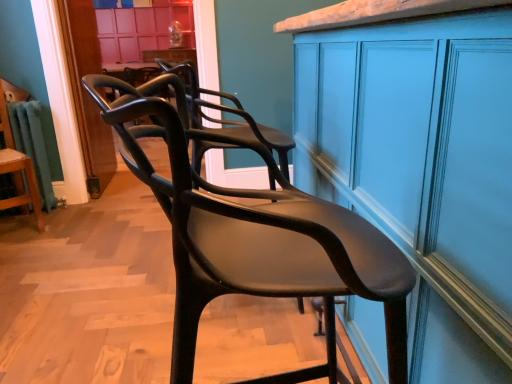
This screenshot has width=512, height=384. I want to click on matte blue cabinet at center, so click(x=419, y=160).

This screenshot has width=512, height=384. Find the location of `matte black chair at left, arranged as the 2th chair when viewed from the front`. matte black chair at left, arranged as the 2th chair when viewed from the front is located at coordinates (18, 170).

What are the coordinates of `matte blue cabinet at center` in the screenshot? It's located at (419, 160).

This screenshot has height=384, width=512. In order to click on chair below the matte blue cabinet at center (from the image's perspective) in this screenshot , I will do `click(255, 237)`.

Which is behind, point (268, 205) or point (449, 2)?

The point (449, 2) is farther.

From the picture: Is matte black chair at center, placed as the first chair when sorted from front to back, to the right of matte blue cabinet at center from the viewer's perspective?

Incorrect, matte black chair at center, placed as the first chair when sorted from front to back, is not on the right side of matte blue cabinet at center.

Is matte black chair at center, placed as the first chair when sorted from front to back, in contact with matte blue cabinet at center?

matte black chair at center, placed as the first chair when sorted from front to back, is not next to matte blue cabinet at center, and they're not touching.

Image resolution: width=512 pixels, height=384 pixels. Identify the location of the 1st chair below the matte blue cabinet at center (from a real-world perspective). (255, 237).

From a real-world perspective, is matte blue cabinet at center positioned above or below matte black chair at center, the 2th chair from the left?

Clearly, from a real-world perspective, matte blue cabinet at center is above matte black chair at center, the 2th chair from the left.

Looking at this image, does matte blue cabinet at center contain matte black chair at center, the second chair in the back-to-front sequence?

No, matte blue cabinet at center does not contain matte black chair at center, the second chair in the back-to-front sequence.

In terms of height, does matte blue cabinet at center look taller or shorter compared to matte black chair at center, the second chair in the back-to-front sequence?

Considering their sizes, matte blue cabinet at center has more height than matte black chair at center, the second chair in the back-to-front sequence.

Is matte black chair at left, which is counted as the first chair, starting from the left, placed right next to matte blue cabinet at center?

No, matte black chair at left, which is counted as the first chair, starting from the left, is not beside matte blue cabinet at center.

From the image's perspective, is matte black chair at left, the 1th chair from the back, below matte blue cabinet at center?

Actually, matte black chair at left, the 1th chair from the back, appears above matte blue cabinet at center in the image.

Does matte black chair at left, marked as the second chair in a right-to-left arrangement, have a larger size compared to matte blue cabinet at center?

No, matte black chair at left, marked as the second chair in a right-to-left arrangement, is not bigger than matte blue cabinet at center.

Can you confirm if matte black chair at center, positioned as the first chair in right-to-left order, is bigger than matte black chair at left, arranged as the 2th chair when viewed from the front?

Yes.

Looking at their sizes, would you say matte black chair at center, placed as the first chair when sorted from front to back, is wider or thinner than matte black chair at left, marked as the second chair in a right-to-left arrangement?

Clearly, matte black chair at center, placed as the first chair when sorted from front to back, has more width compared to matte black chair at left, marked as the second chair in a right-to-left arrangement.

In the scene shown: Is matte black chair at center, positioned as the first chair in right-to-left order, aimed at matte black chair at left, arranged as the 2th chair when viewed from the front?

No, matte black chair at center, positioned as the first chair in right-to-left order, is not facing towards matte black chair at left, arranged as the 2th chair when viewed from the front.

The image size is (512, 384). Identify the location of chair on the left of the matte black chair at center, the second chair in the back-to-front sequence. (18, 170).

From their relative heights in the image, would you say matte black chair at left, arranged as the 2th chair when viewed from the front, is taller or shorter than matte black chair at center, the second chair in the back-to-front sequence?

In the image, matte black chair at left, arranged as the 2th chair when viewed from the front, appears to be taller than matte black chair at center, the second chair in the back-to-front sequence.

Can you confirm if matte black chair at left, which is counted as the first chair, starting from the left, is smaller than matte black chair at center, placed as the first chair when sorted from front to back?

Correct, matte black chair at left, which is counted as the first chair, starting from the left, occupies less space than matte black chair at center, placed as the first chair when sorted from front to back.

How distant is matte black chair at left, the 1th chair from the back, from matte black chair at center, positioned as the first chair in right-to-left order?

matte black chair at left, the 1th chair from the back, and matte black chair at center, positioned as the first chair in right-to-left order, are 2.02 meters apart from each other.

Is matte blue cabinet at center located outside matte black chair at left, the 1th chair from the back?

Yes, matte blue cabinet at center is outside of matte black chair at left, the 1th chair from the back.

Considering the positions of point (313, 159) and point (32, 185), is point (313, 159) closer or farther from the camera than point (32, 185)?

Point (313, 159) is positioned closer to the camera compared to point (32, 185).

Is matte blue cabinet at center wider or thinner than matte black chair at left, which is counted as the first chair, starting from the left?

In the image, matte blue cabinet at center appears to be wider than matte black chair at left, which is counted as the first chair, starting from the left.

In terms of size, does matte blue cabinet at center appear bigger or smaller than matte black chair at left, which is counted as the first chair, starting from the left?

matte blue cabinet at center is bigger than matte black chair at left, which is counted as the first chair, starting from the left.

Where is `chair below the matte blue cabinet at center (from the image's perspective)`? chair below the matte blue cabinet at center (from the image's perspective) is located at coordinates (255, 237).

Identify the location of cabinetry above the matte black chair at center, positioned as the first chair in right-to-left order (from the image's perspective). Image resolution: width=512 pixels, height=384 pixels. (419, 160).

Estimate the real-world distances between objects in this image. Which object is closer to matte black chair at center, the second chair in the back-to-front sequence, matte black chair at left, marked as the second chair in a right-to-left arrangement, or matte blue cabinet at center?

Based on the image, matte blue cabinet at center appears to be nearer to matte black chair at center, the second chair in the back-to-front sequence.

Which object lies further to the anchor point matte black chair at center, positioned as the first chair in right-to-left order, matte blue cabinet at center or matte black chair at left, marked as the second chair in a right-to-left arrangement?

matte black chair at left, marked as the second chair in a right-to-left arrangement, lies further to matte black chair at center, positioned as the first chair in right-to-left order, than the other object.

Based on the photo, from the image, which object appears to be nearer to matte black chair at left, arranged as the 2th chair when viewed from the front, matte black chair at center, the second chair in the back-to-front sequence, or matte blue cabinet at center?

matte blue cabinet at center is positioned closer to the anchor matte black chair at left, arranged as the 2th chair when viewed from the front.

Looking at the image, which one is located closer to matte black chair at left, which is counted as the first chair, starting from the left, matte blue cabinet at center or matte black chair at center, the second chair in the back-to-front sequence?

matte blue cabinet at center is positioned closer to the anchor matte black chair at left, which is counted as the first chair, starting from the left.

Which object lies nearer to the anchor point matte blue cabinet at center, matte black chair at center, the second chair in the back-to-front sequence, or matte black chair at left, marked as the second chair in a right-to-left arrangement?

matte black chair at center, the second chair in the back-to-front sequence, lies closer to matte blue cabinet at center than the other object.

In the scene shown: Estimate the real-world distances between objects in this image. Which object is closer to matte blue cabinet at center, matte black chair at left, marked as the second chair in a right-to-left arrangement, or matte black chair at center, placed as the first chair when sorted from front to back?

matte black chair at center, placed as the first chair when sorted from front to back.

Where is `chair between matte black chair at left, which is counted as the first chair, starting from the left, and matte blue cabinet at center from left to right`? The height and width of the screenshot is (384, 512). chair between matte black chair at left, which is counted as the first chair, starting from the left, and matte blue cabinet at center from left to right is located at coordinates (255, 237).